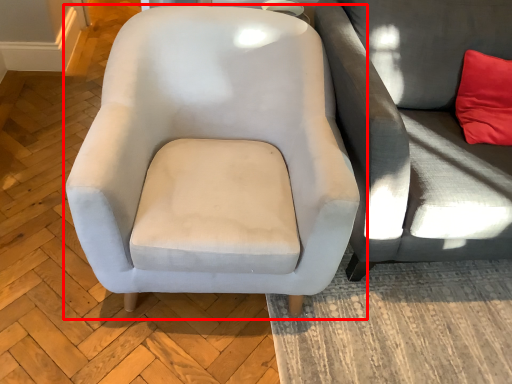
Question: In this image, where is chair (annotated by the red box) located relative to studio couch?

Choices:
 (A) left
 (B) right

Answer: (A)